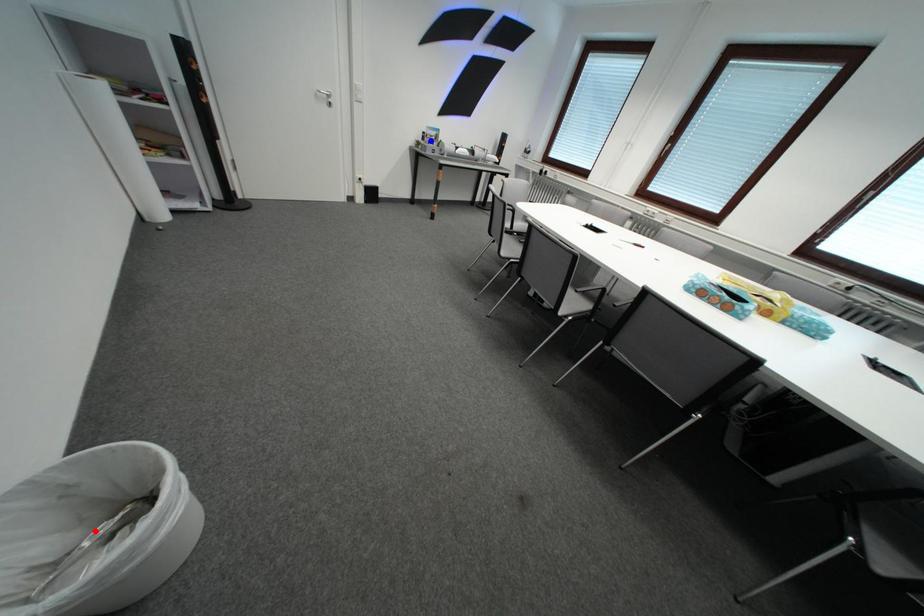
Question: Two points are marked on the image. Which point is closer to the camera?

Choices:
 (A) Blue point is closer.
 (B) Red point is closer.

Answer: (B)